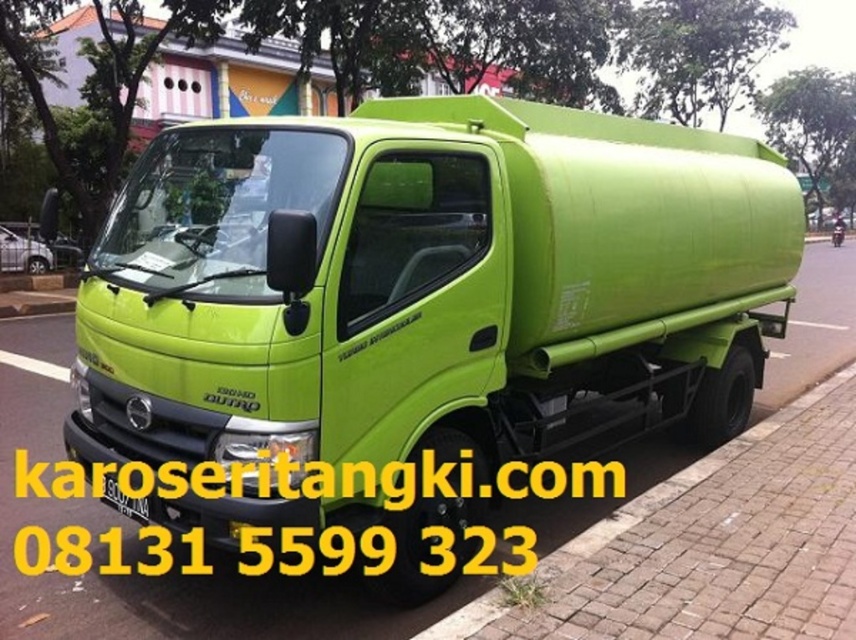
You are a delivery driver who needs to park your truck on the brick pavement at lower right. However, the yellow matte license plate at center is blocking the entrance. Can you still park there?

The brick pavement at lower right is smaller than the yellow matte license plate at center. Since the license plate is blocking the entrance, it is likely that the pavement is too small to accommodate the truck, so you cannot park there.

You are a pedestrian standing on the sidewalk. You see the green matte truck at center and the brick pavement at lower right. Which object is closer to you?

The green matte truck at center is closer to you because it is positioned in front of the brick pavement at lower right.